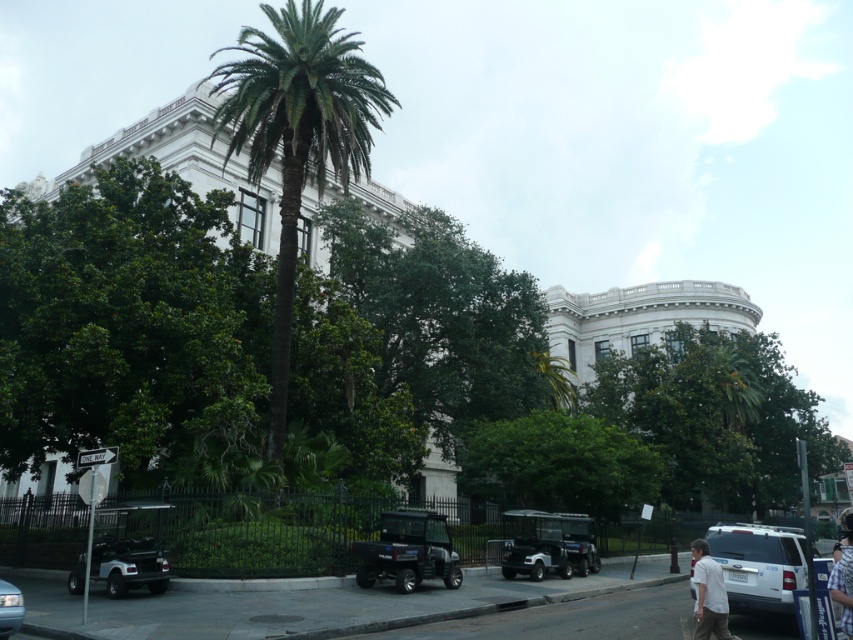
Can you confirm if black matte utility vehicle at center is wider than metallic blue car at lower left?

Yes.

Consider the image. Measure the distance between point (x=384, y=545) and camera.

A distance of 16.70 meters exists between point (x=384, y=545) and camera.

Does point (398, 573) come farther from viewer compared to point (16, 628)?

That is True.

This screenshot has width=853, height=640. I want to click on black matte utility vehicle at center, so click(408, 552).

Describe the element at coordinates (122, 564) in the screenshot. I see `black matte golf cart at lower left` at that location.

Can you confirm if black matte golf cart at lower left is positioned above metallic blue car at lower left?

No.

What do you see at coordinates (122, 564) in the screenshot?
I see `black matte golf cart at lower left` at bounding box center [122, 564].

This screenshot has width=853, height=640. I want to click on black matte golf cart at lower left, so click(122, 564).

Does green leafy palm tree at center have a lesser height compared to white cotton shirt at lower right?

In fact, green leafy palm tree at center may be taller than white cotton shirt at lower right.

Looking at this image, between green leafy palm tree at center and white cotton shirt at lower right, which one appears on the left side from the viewer's perspective?

From the viewer's perspective, green leafy palm tree at center appears more on the left side.

Where is `green leafy palm tree at center`? green leafy palm tree at center is located at coordinates (297, 138).